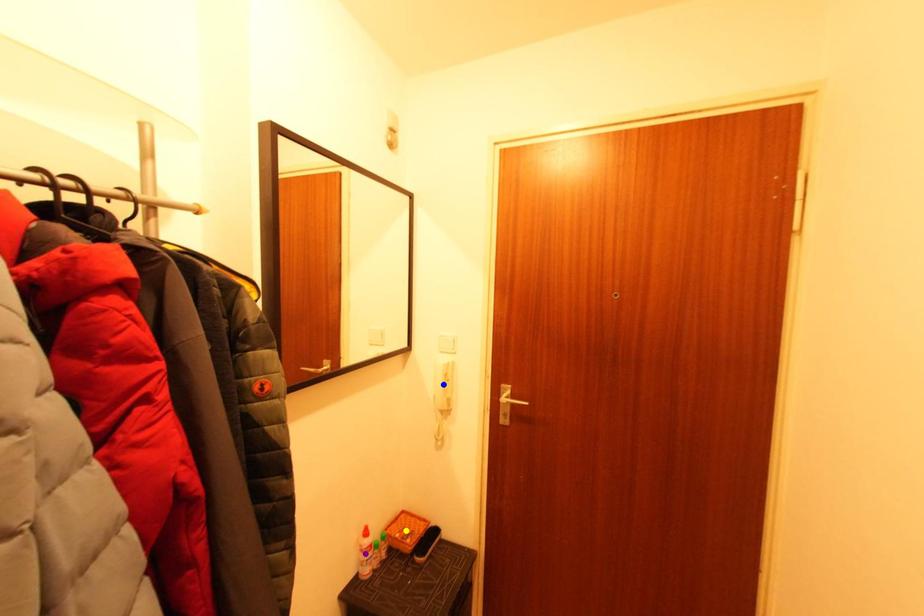
Order these from nearest to farthest:
purple point | blue point | yellow point

purple point
blue point
yellow point